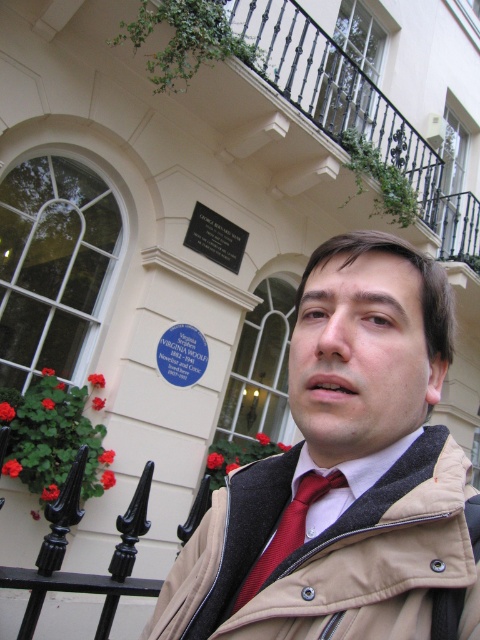
You are a tour guide explaining the historical plaques to a group. You notice the red satin tie at center and the black polished stone plaque at upper center. Which object is located to the right of the other?

The red satin tie at center is positioned on the right side of black polished stone plaque at upper center.

You are an architect visiting the building and want to take a photo of the red tie at center. Where should you position your camera to capture it clearly?

The red tie at center is located at coordinates point (343,472). Position your camera to focus on that point to capture it clearly.

You are standing in front of the building with the beige jacketed person. There are two points marked on the building wall. The first point is at coordinate point (x=280, y=518) and the second is at point (x=208, y=227). Which point is closer to you?

Point (x=280, y=518) is in front of point (x=208, y=227), so it is closer to you.